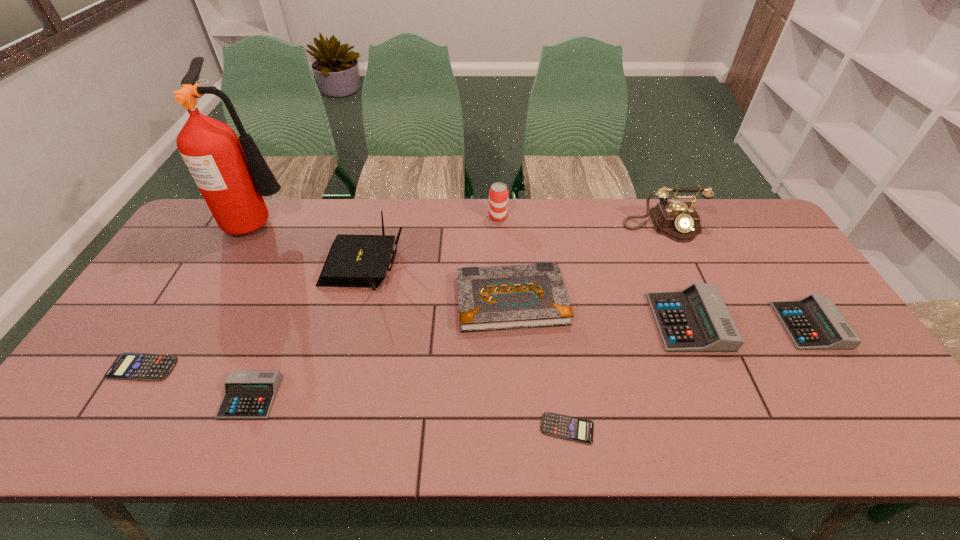
Find the location of a particular element. The image size is (960, 540). the rightmost gray calculator is located at coordinates (814, 322).

You are a GUI agent. You are given a task and a screenshot of the screen. Output one action in this format:
    pyautogui.click(x=<x>, y=<y>)
    Task: Click on the second tallest calculator
    
    Given the screenshot: What is the action you would take?
    pyautogui.click(x=814, y=322)

Where is `the nearest gray calculator`? the nearest gray calculator is located at coordinates pyautogui.click(x=249, y=394).

Identify the location of the leftmost gray calculator. (249, 394).

Find the location of a particular element. The width and height of the screenshot is (960, 540). the second shortest object is located at coordinates (128, 366).

Locate an element on the screen. This screenshot has height=540, width=960. the bigger blue calculator is located at coordinates (128, 366).

This screenshot has height=540, width=960. I want to click on the shortest object, so pyautogui.click(x=575, y=429).

I want to click on the smaller blue calculator, so click(575, 429).

The height and width of the screenshot is (540, 960). I want to click on vacant area situated 0.100m at the nozzle of the tallest object, so click(x=324, y=220).

You are a GUI agent. You are given a task and a screenshot of the screen. Output one action in this format:
    pyautogui.click(x=<x>, y=<y>)
    Task: Click on the free region located 0.400m on the dial of the telephone
    The width and height of the screenshot is (960, 540).
    Given the screenshot: What is the action you would take?
    pyautogui.click(x=717, y=345)